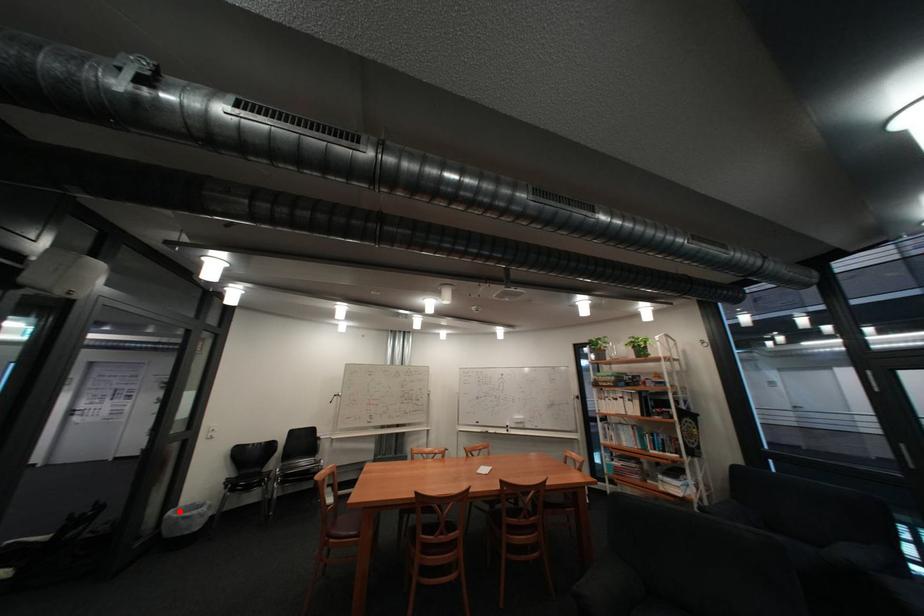
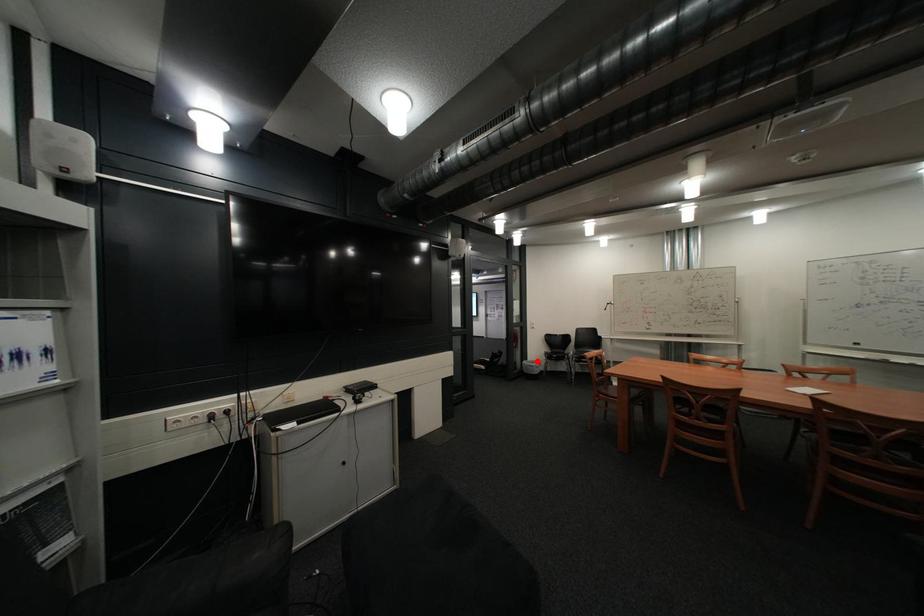
I am providing you with two images of the same scene from different viewpoints. A red point is marked on the first image and another point is marked on the second image. Do the highlighted points in image1 and image2 indicate the same real-world spot?

Yes